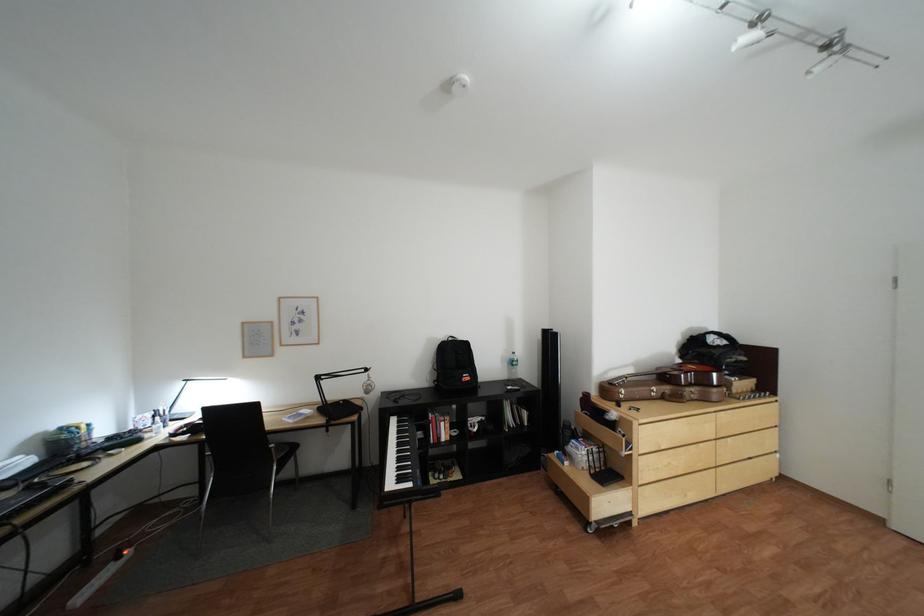
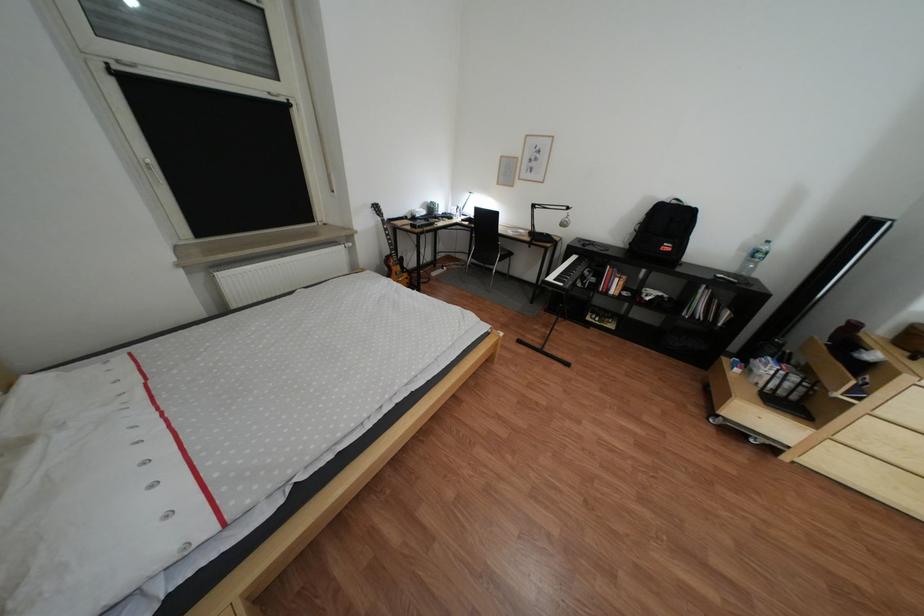
Locate, in the second image, the point that corresponds to (415,461) in the first image.

(578, 274)